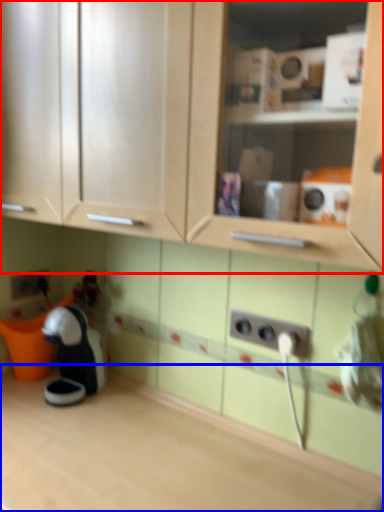
Question: Which object appears closest to the camera in this image, cabinetry (highlighted by a red box) or countertop (highlighted by a blue box)?

Choices:
 (A) cabinetry
 (B) countertop

Answer: (A)